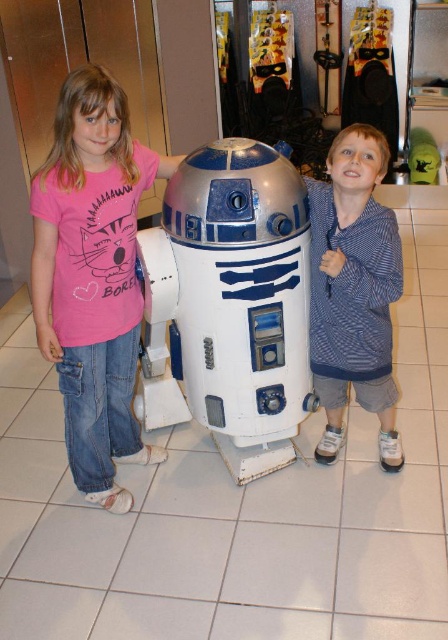
Question: Can you confirm if pink cotton t-shirt at left is thinner than blue striped hoodie at center?

Choices:
 (A) yes
 (B) no

Answer: (B)

Question: Is silver metallic robot at center to the left of blue striped hoodie at center from the viewer's perspective?

Choices:
 (A) yes
 (B) no

Answer: (A)

Question: Which of these objects is positioned farthest from the silver metallic robot at center?

Choices:
 (A) pink cotton t-shirt at left
 (B) blue striped hoodie at center

Answer: (A)

Question: Which point is farther from the camera taking this photo?

Choices:
 (A) (211, 253)
 (B) (388, 220)

Answer: (B)

Question: Among these objects, which one is farthest from the camera?

Choices:
 (A) pink cotton t-shirt at left
 (B) silver metallic robot at center
 (C) blue striped hoodie at center

Answer: (C)

Question: Is silver metallic robot at center smaller than pink cotton t-shirt at left?

Choices:
 (A) yes
 (B) no

Answer: (B)